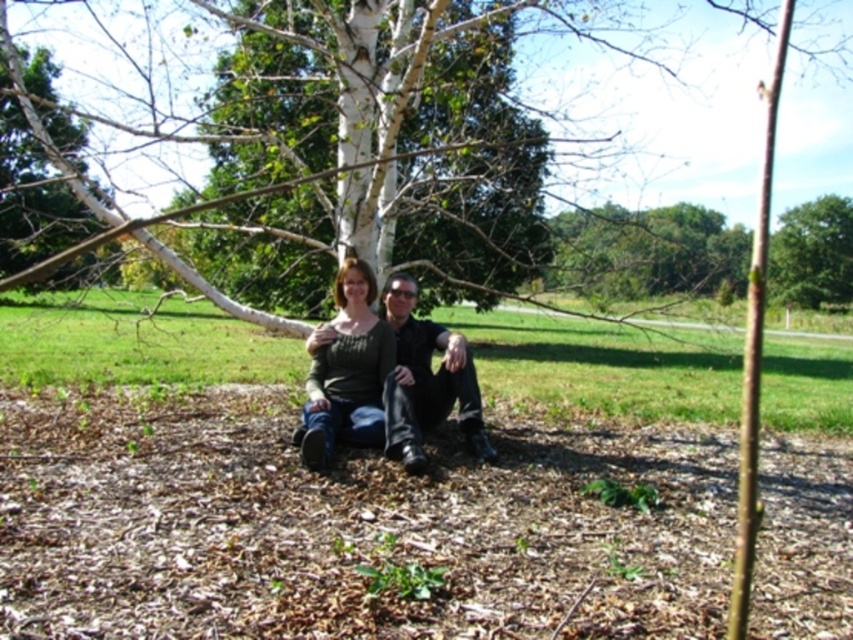
Question: Considering the relative positions of matte green sweater at center and black leather jacket at center in the image provided, where is matte green sweater at center located with respect to black leather jacket at center?

Choices:
 (A) left
 (B) right

Answer: (A)

Question: Among these points, which one is nearest to the camera?

Choices:
 (A) (341, 326)
 (B) (398, 458)

Answer: (B)

Question: Can you confirm if matte green sweater at center is positioned to the left of black leather jacket at center?

Choices:
 (A) yes
 (B) no

Answer: (A)

Question: Is the position of matte green sweater at center more distant than that of black leather jacket at center?

Choices:
 (A) no
 (B) yes

Answer: (B)